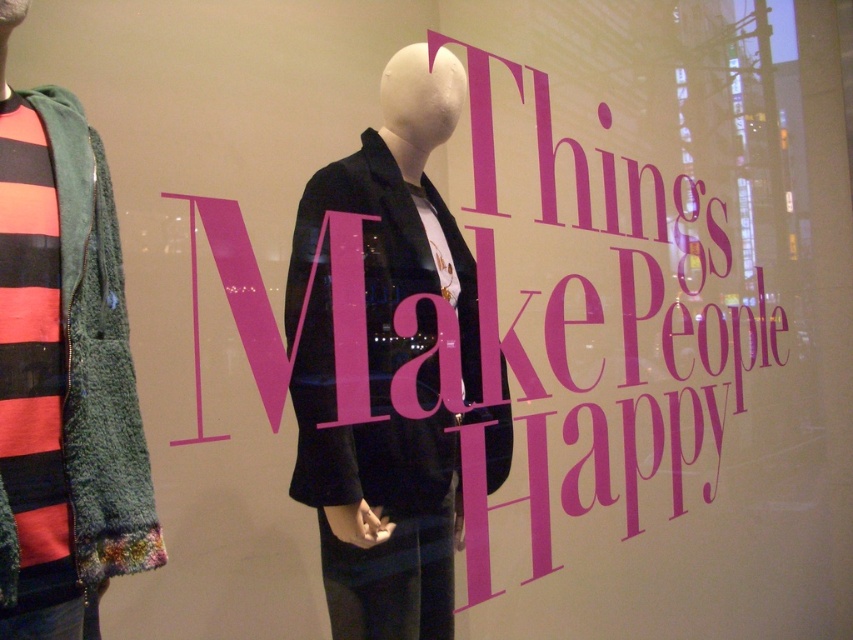
You are a customer looking at the retail display. You see the pink paper at center and the green fuzzy jacket at left. Which item is placed higher up?

The pink paper at center is positioned over the green fuzzy jacket at left, so it is placed higher up.